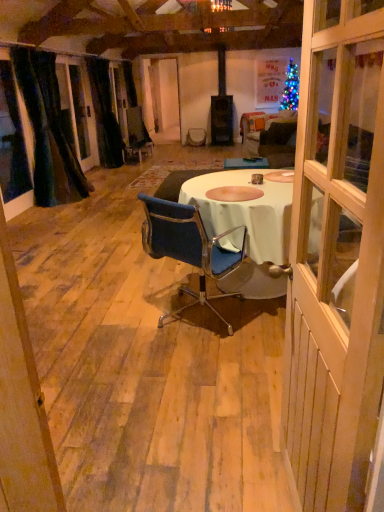
Where is `vacant space in front of blue fabric chair at center`? vacant space in front of blue fabric chair at center is located at coordinates (195, 372).